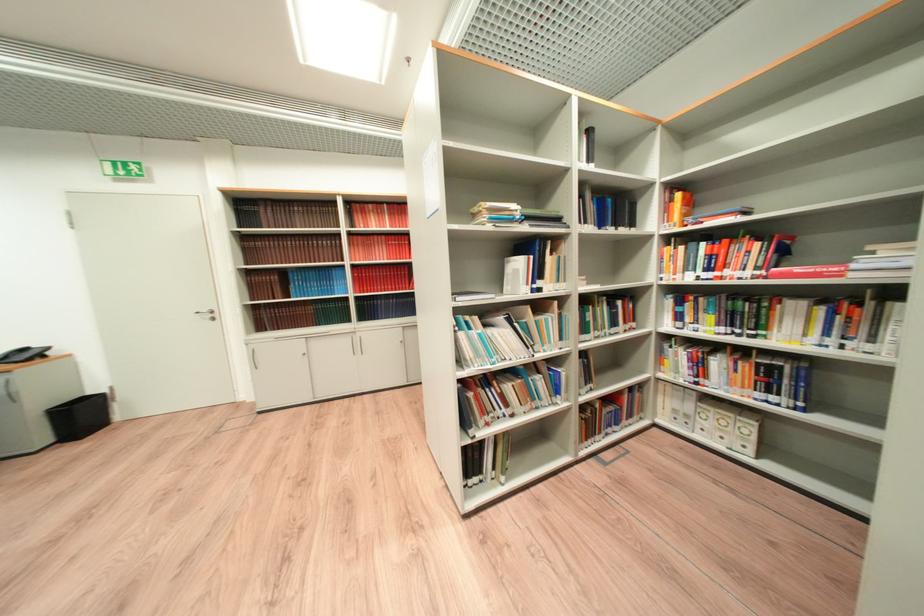
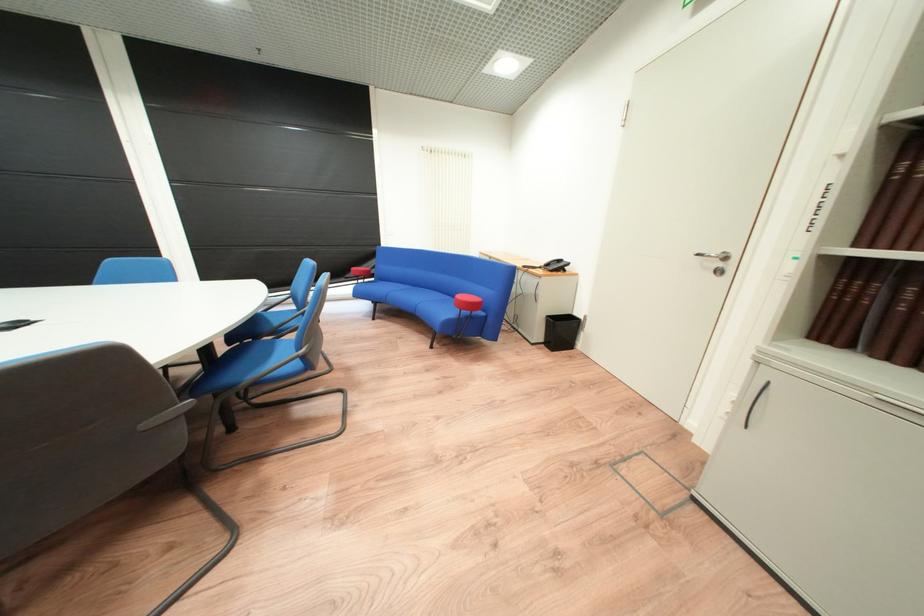
The point at [92,418] is marked in the first image. Where is the corresponding point in the second image?

(573, 333)